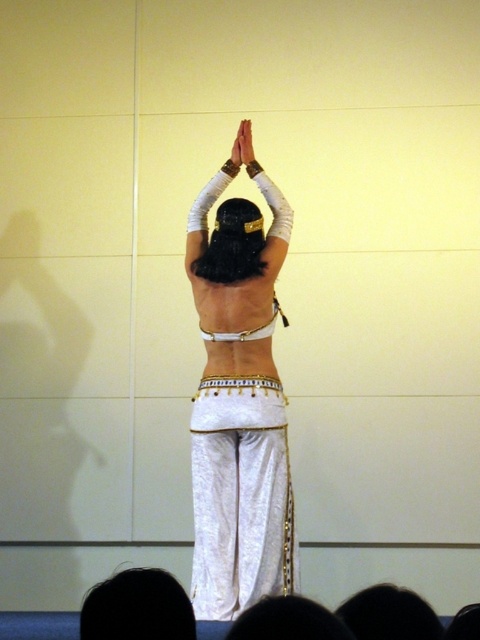
You are a photographer at the back of the stage. You see the dancer with their back to you, and you notice two areas of dark hair in the scene. The first is the dark hair at lower left, and the second is the dark hair at center. Which dark hair area is positioned lower in the image?

The dark hair at lower left is located below dark hair at center, so the dark hair at lower left is positioned lower in the image.

You are a stage designer planning to place two spotlights on the stage. The first spotlight needs to be placed at point (256, 406) and the second at point (348, 604). Based on the dancer position, will the first spotlight be visible to the audience when the dancer is in the described pose?

Point (256, 406) is behind point (348, 604), so the first spotlight will be blocked by the dancer when they are in the described pose, making it less visible to the audience.